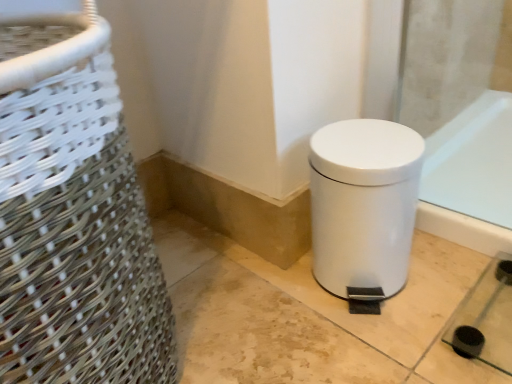
You are a GUI agent. You are given a task and a screenshot of the screen. Output one action in this format:
    pyautogui.click(x=<x>, y=<y>)
    Task: Click on the vacant area that is in front of white matte waste container at lower right
    The image size is (512, 384).
    Given the screenshot: What is the action you would take?
    pyautogui.click(x=377, y=346)